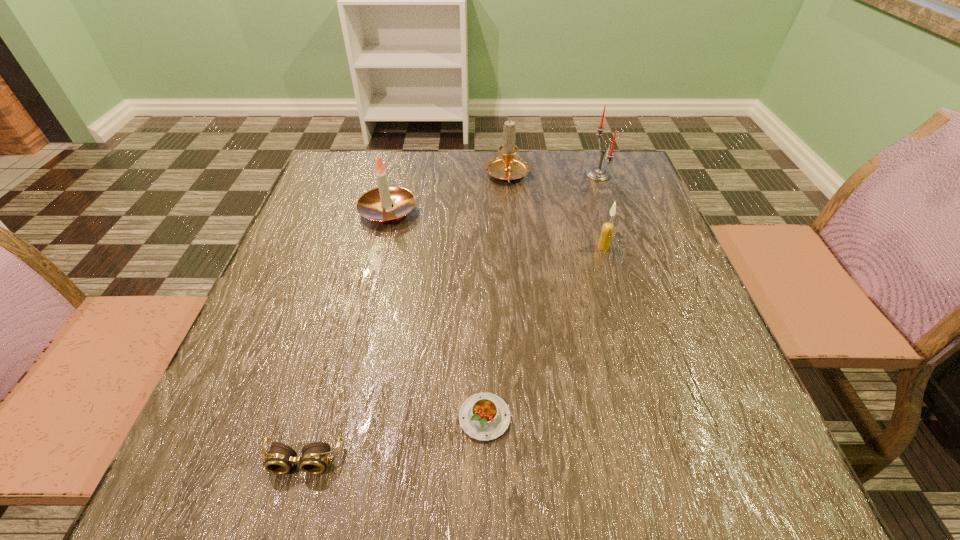
In the image, there is a desktop. In order to click on free space at the near right corner in this screenshot , I will do `click(714, 457)`.

I want to click on free space between the second candle from right to left and the nearest object, so click(453, 353).

Find the location of a particular element. The height and width of the screenshot is (540, 960). vacant area between the third farthest object and the rightmost object is located at coordinates (493, 193).

Locate an element on the screen. Image resolution: width=960 pixels, height=540 pixels. unoccupied area between the second shortest object and the third nearest object is located at coordinates (453, 353).

Identify the location of free space between the second candle from left to right and the nearest object. This screenshot has height=540, width=960. point(405,318).

This screenshot has height=540, width=960. I want to click on empty space between the second candle from left to right and the fourth nearest object, so click(447, 194).

Locate an element on the screen. free spot between the second nearest object and the shortest candle is located at coordinates (544, 333).

Where is `unoccupied position between the rightmost candle and the shortest candle`? This screenshot has width=960, height=540. unoccupied position between the rightmost candle and the shortest candle is located at coordinates (601, 211).

The width and height of the screenshot is (960, 540). I want to click on vacant space that's between the nearest object and the pudding, so [394, 438].

Locate an element on the screen. The width and height of the screenshot is (960, 540). empty location between the rightmost object and the fifth tallest object is located at coordinates (451, 317).